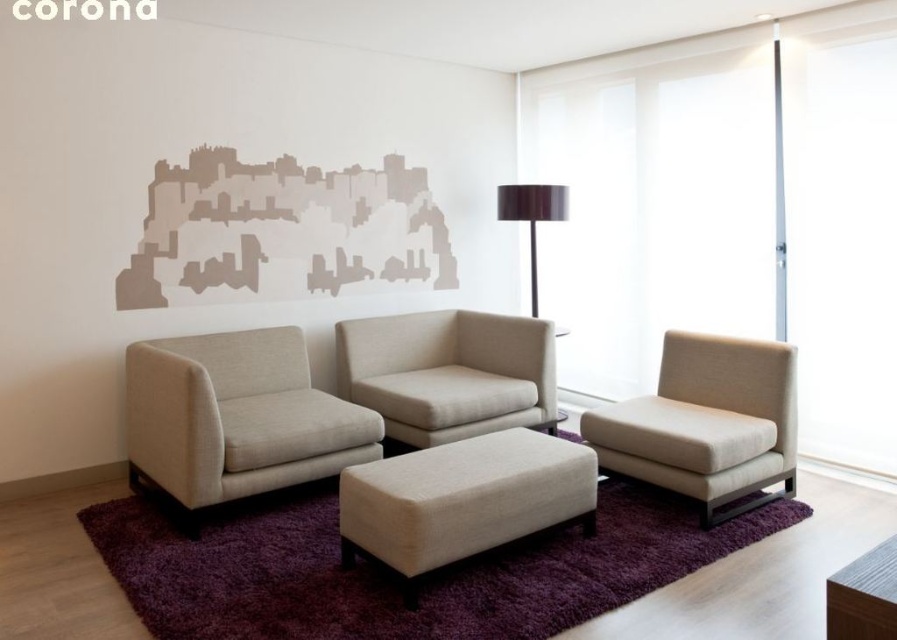
Does point (782, 406) lie in front of point (347, 396)?

That is True.

Between beige fabric armchair at right and beige fabric couch at center, which one has less height?

beige fabric couch at center is shorter.

Is point (684, 378) farther from viewer compared to point (376, 352)?

No, it is not.

Identify the location of beige fabric armchair at right. The height and width of the screenshot is (640, 897). (706, 422).

From the picture: Is beige fabric armchair at right further to camera compared to shiny dark brown lampshade at upper right?

That is False.

Can you confirm if beige fabric armchair at right is taller than shiny dark brown lampshade at upper right?

Incorrect, beige fabric armchair at right's height is not larger of shiny dark brown lampshade at upper right's.

Who is more distant from viewer, (686, 435) or (542, 198)?

The point (542, 198) is behind.

Image resolution: width=897 pixels, height=640 pixels. I want to click on beige fabric armchair at right, so click(706, 422).

Does point (512, 531) come in front of point (518, 214)?

Yes, point (512, 531) is in front of point (518, 214).

Can you confirm if beige fabric ottoman at center is taller than shiny dark brown lampshade at upper right?

No, beige fabric ottoman at center is not taller than shiny dark brown lampshade at upper right.

I want to click on beige fabric ottoman at center, so click(462, 500).

Image resolution: width=897 pixels, height=640 pixels. I want to click on beige fabric ottoman at center, so click(462, 500).